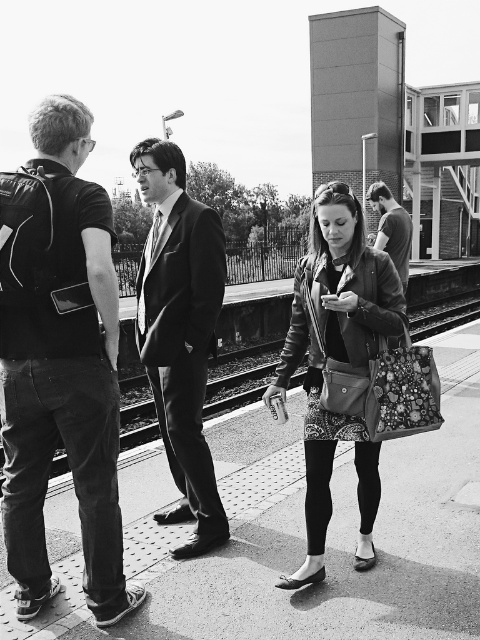
Question: Does matte black suit at center have a lesser width compared to dark gray suit at right?

Choices:
 (A) yes
 (B) no

Answer: (A)

Question: Which object is the farthest from the leather jacket at center?

Choices:
 (A) matte black suit at center
 (B) dark gray suit at right
 (C) black fabric backpack at left

Answer: (B)

Question: Which is nearer to the leather jacket at center?

Choices:
 (A) black fabric backpack at left
 (B) matte black suit at center
 (C) dark gray suit at right

Answer: (B)

Question: Which of the following is the closest to the observer?

Choices:
 (A) dark gray suit at right
 (B) leather jacket at center
 (C) matte black suit at center

Answer: (B)

Question: In this image, where is leather jacket at center located relative to matte black suit at center?

Choices:
 (A) right
 (B) left

Answer: (A)

Question: Is leather jacket at center further to camera compared to matte black suit at center?

Choices:
 (A) yes
 (B) no

Answer: (B)